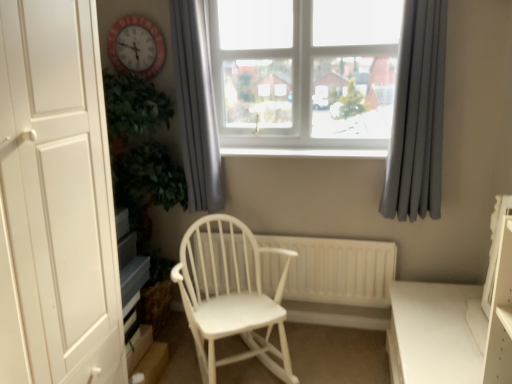
Where is `white plastic window at upper center`? white plastic window at upper center is located at coordinates (303, 71).

The width and height of the screenshot is (512, 384). What do you see at coordinates (305, 152) in the screenshot? I see `white wood at center` at bounding box center [305, 152].

Image resolution: width=512 pixels, height=384 pixels. Describe the element at coordinates (196, 106) in the screenshot. I see `gray fabric curtain at upper center, marked as the second curtain in a right-to-left arrangement` at that location.

Describe the element at coordinates (56, 200) in the screenshot. I see `white matte door at left` at that location.

What are the coordinates of `white plastic window at upper center` in the screenshot? It's located at (303, 71).

Which of these two, gray fabric curtain at upper center, which appears as the first curtain when viewed from the left, or white matte door at left, is smaller?

Smaller between the two is gray fabric curtain at upper center, which appears as the first curtain when viewed from the left.

Is point (206, 29) positioned before point (19, 179)?

No.

Is gray fabric curtain at upper center, marked as the second curtain in a right-to-left arrangement, not inside white matte door at left?

Yes.

From the image's perspective, which is below, white glossy table at lower right or white wood at center?

white glossy table at lower right.

Considering the relative sizes of white glossy table at lower right and white wood at center in the image provided, is white glossy table at lower right smaller than white wood at center?

No.

Is white glossy table at lower right looking in the opposite direction of white wood at center?

No, white glossy table at lower right's orientation is not away from white wood at center.

Can you confirm if white glossy table at lower right is positioned to the left of white wood at center?

No.

Is gray fabric curtain at upper right, arranged as the 2th curtain when viewed from the left, positioned with its back to white glossy table at lower right?

gray fabric curtain at upper right, arranged as the 2th curtain when viewed from the left, does not have its back to white glossy table at lower right.

From a real-world perspective, which object stands above the other?

From a 3D spatial view, gray fabric curtain at upper right, which is the first curtain from right to left, is above.

Considering the relative sizes of gray fabric curtain at upper right, which is the first curtain from right to left, and white glossy table at lower right in the image provided, is gray fabric curtain at upper right, which is the first curtain from right to left, thinner than white glossy table at lower right?

Yes, gray fabric curtain at upper right, which is the first curtain from right to left, is thinner than white glossy table at lower right.

Which is farther from the camera, (430, 9) or (425, 340)?

The point (430, 9) is more distant.

Locate an element on the screen. The image size is (512, 384). door below the white wood at center (from the image's perspective) is located at coordinates (56, 200).

Can you confirm if white wood at center is smaller than white matte door at left?

Yes.

Which is in front, point (361, 150) or point (103, 208)?

The point (103, 208) is closer to the camera.

How much distance is there between white wood at center and white matte door at left?

white wood at center is 1.16 meters from white matte door at left.

Can you confirm if white wood at center is positioned to the right of white glossy table at lower right?

No, white wood at center is not to the right of white glossy table at lower right.

From a real-world perspective, is white wood at center physically located above or below white glossy table at lower right?

In terms of real-world spatial position, white wood at center is above white glossy table at lower right.

Is white glossy table at lower right located within white wood at center?

No, white glossy table at lower right is located outside of white wood at center.

This screenshot has width=512, height=384. In order to click on table on the right of white wood at center in this screenshot , I will do `click(432, 334)`.

From a real-world perspective, is white plastic window at upper center physically below gray fabric curtain at upper right, arranged as the 2th curtain when viewed from the left?

Incorrect, from a real-world perspective, white plastic window at upper center is higher than gray fabric curtain at upper right, arranged as the 2th curtain when viewed from the left.

Is the position of white plastic window at upper center less distant than that of gray fabric curtain at upper right, which is the first curtain from right to left?

No, white plastic window at upper center is further to the viewer.

Could you measure the distance between white plastic window at upper center and gray fabric curtain at upper right, arranged as the 2th curtain when viewed from the left?

white plastic window at upper center and gray fabric curtain at upper right, arranged as the 2th curtain when viewed from the left, are 17.83 inches apart.

From the image's perspective, would you say white plastic window at upper center is shown under gray fabric curtain at upper right, which is the first curtain from right to left?

No, from the image's perspective, white plastic window at upper center is not beneath gray fabric curtain at upper right, which is the first curtain from right to left.

Based on the photo, is white glossy table at lower right next to white plastic window at upper center and touching it?

white glossy table at lower right and white plastic window at upper center are not in contact.

Is white glossy table at lower right outside of white plastic window at upper center?

Absolutely, white glossy table at lower right is external to white plastic window at upper center.

Based on the photo, between white glossy table at lower right and white plastic window at upper center, which one has less height?

With less height is white glossy table at lower right.

Locate an element on the screen. This screenshot has width=512, height=384. door in front of the gray fabric curtain at upper center, which appears as the first curtain when viewed from the left is located at coordinates (56, 200).

I want to click on window sill above the white glossy table at lower right (from the image's perspective), so click(x=305, y=152).

Considering their positions, is gray fabric curtain at upper center, which appears as the first curtain when viewed from the left, positioned closer to white matte door at left than red plastic clock at upper left?

The object closer to white matte door at left is gray fabric curtain at upper center, which appears as the first curtain when viewed from the left.

When comparing their distances from white wood rocking chair at center, does gray fabric curtain at upper right, which is the first curtain from right to left, or white plastic window at upper center seem closer?

Based on the image, white plastic window at upper center appears to be nearer to white wood rocking chair at center.

Which object lies further to the anchor point white wooden radiator at center, white wood rocking chair at center or white matte door at left?

Among the two, white matte door at left is located further to white wooden radiator at center.

Which object lies nearer to the anchor point gray fabric curtain at upper right, arranged as the 2th curtain when viewed from the left, white wood rocking chair at center or white plastic window at upper center?

Based on the image, white plastic window at upper center appears to be nearer to gray fabric curtain at upper right, arranged as the 2th curtain when viewed from the left.

Looking at the image, which one is located further to gray fabric curtain at upper right, arranged as the 2th curtain when viewed from the left, white glossy table at lower right or white wood at center?

white glossy table at lower right is positioned further to the anchor gray fabric curtain at upper right, arranged as the 2th curtain when viewed from the left.

Looking at the image, which one is located further to white glossy table at lower right, white wood rocking chair at center or white wood at center?

Among the two, white wood at center is located further to white glossy table at lower right.

Considering their positions, is white matte door at left positioned further to white wood rocking chair at center than white wooden radiator at center?

white matte door at left.

Estimate the real-world distances between objects in this image. Which object is closer to white wood at center, white glossy table at lower right or white wood rocking chair at center?

white wood rocking chair at center lies closer to white wood at center than the other object.

Locate an element on the screen. This screenshot has height=384, width=512. window sill between red plastic clock at upper left and gray fabric curtain at upper right, which is the first curtain from right to left, in the horizontal direction is located at coordinates pyautogui.click(x=305, y=152).

Image resolution: width=512 pixels, height=384 pixels. I want to click on window sill between gray fabric curtain at upper right, which is the first curtain from right to left, and white wooden radiator at center vertically, so click(305, 152).

Where is `window between red plastic clock at upper left and white glossy table at lower right from top to bottom`? window between red plastic clock at upper left and white glossy table at lower right from top to bottom is located at coordinates (303, 71).

Where is `window sill between gray fabric curtain at upper right, which is the first curtain from right to left, and white wood rocking chair at center vertically`? The width and height of the screenshot is (512, 384). window sill between gray fabric curtain at upper right, which is the first curtain from right to left, and white wood rocking chair at center vertically is located at coordinates (305, 152).